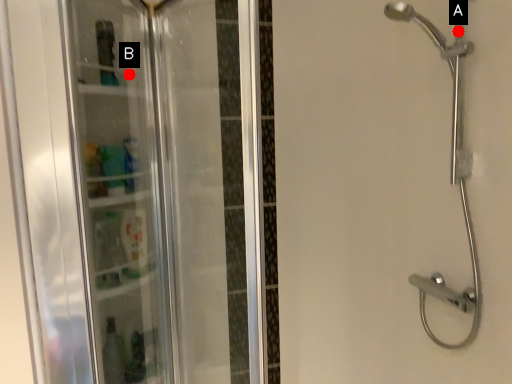
Question: Two points are circled on the image, labeled by A and B beside each circle. Which point is closer to the camera taking this photo?

Choices:
 (A) A is closer
 (B) B is closer

Answer: (B)